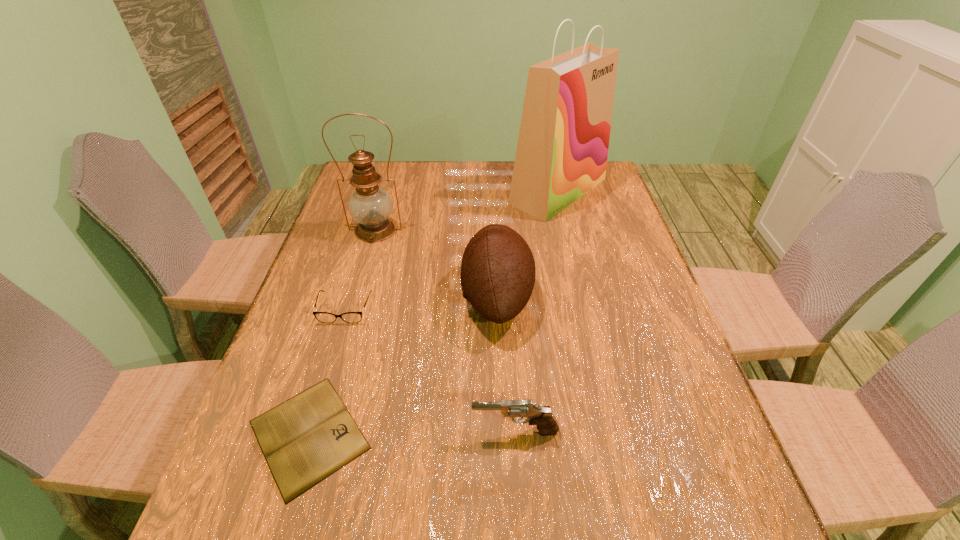
Find the location of a particular element. This screenshot has height=540, width=960. vacant region located 0.150m on the laces of the third tallest object is located at coordinates (403, 297).

The height and width of the screenshot is (540, 960). I want to click on free space located 0.210m at the barrel of the third shortest object, so click(366, 431).

In order to click on vacant space located at the barrel of the third shortest object in this screenshot , I will do `click(421, 431)`.

Where is `vacant point located at the barrel of the third shortest object`? The height and width of the screenshot is (540, 960). vacant point located at the barrel of the third shortest object is located at coordinates (366, 431).

You are a GUI agent. You are given a task and a screenshot of the screen. Output one action in this format:
    pyautogui.click(x=<x>, y=<y>)
    Task: Click on the free space located on the front-facing side of the second shortest object
    The height and width of the screenshot is (540, 960).
    Given the screenshot: What is the action you would take?
    pyautogui.click(x=321, y=387)

The image size is (960, 540). I want to click on vacant area located on the right of the shortest object, so click(x=512, y=435).

You are a GUI agent. You are given a task and a screenshot of the screen. Output one action in this format:
    pyautogui.click(x=<x>, y=<y>)
    Task: Click on the object present at the far edge
    Image resolution: width=960 pixels, height=540 pixels.
    Given the screenshot: What is the action you would take?
    562,149

At what (x,y) coordinates should I click in order to perform the action: click on oil lamp that is at the left edge. Please return your answer as a coordinate pair (x, y). Looking at the image, I should click on (371, 206).

Find the location of a particular element. spectacles located at the left edge is located at coordinates (324, 317).

Image resolution: width=960 pixels, height=540 pixels. In order to click on book situated at the left edge in this screenshot , I will do `click(307, 438)`.